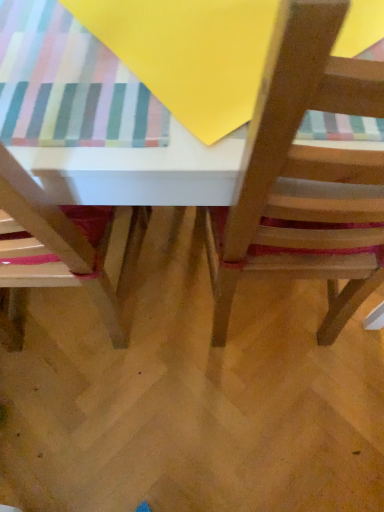
You are a GUI agent. You are given a task and a screenshot of the screen. Output one action in this format:
    pyautogui.click(x=<x>, y=<y>)
    Task: Click on the free space in front of wooden chair at lower left, which appears as the 1th chair when viewed from the left
    This screenshot has height=512, width=384.
    Given the screenshot: What is the action you would take?
    pyautogui.click(x=82, y=431)